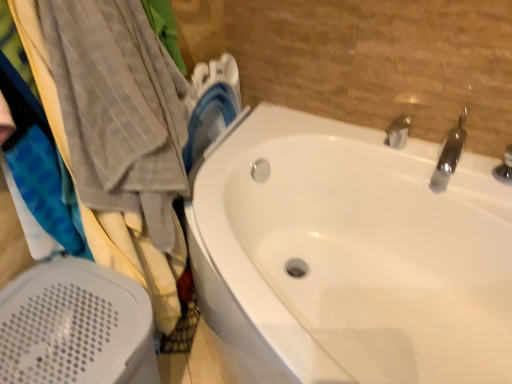
Where is `white glossy bathtub at center`? Image resolution: width=512 pixels, height=384 pixels. white glossy bathtub at center is located at coordinates (350, 256).

In order to click on white glossy bathtub at center in this screenshot , I will do `click(350, 256)`.

From the image's perspective, which one is positioned lower, polished chrome faucet at upper right, the first tap when ordered from right to left, or white plastic bath heater at lower left?

white plastic bath heater at lower left appears lower in the image.

Which is farther from the camera, [455,146] or [30,322]?

The point [455,146] is farther.

Is polished chrome faucet at upper right, the first tap when ordered from right to left, positioned with its back to white plastic bath heater at lower left?

No, polished chrome faucet at upper right, the first tap when ordered from right to left,'s orientation is not away from white plastic bath heater at lower left.

Can you confirm if polished chrome faucet at upper right, the first tap when ordered from right to left, is wider than white plastic bath heater at lower left?

Incorrect, the width of polished chrome faucet at upper right, the first tap when ordered from right to left, does not surpass that of white plastic bath heater at lower left.

Which is less distant, [60,381] or [428,353]?

The point [60,381] is in front.

Which object is positioned more to the left, white plastic bath heater at lower left or white glossy bathtub at center?

From the viewer's perspective, white plastic bath heater at lower left appears more on the left side.

Is white plastic bath heater at lower left oriented away from white glossy bathtub at center?

Yes.

Considering the relative sizes of white plastic bath heater at lower left and silver metallic tap at upper right, the 2th tap in the right-to-left sequence, in the image provided, is white plastic bath heater at lower left shorter than silver metallic tap at upper right, the 2th tap in the right-to-left sequence,?

In fact, white plastic bath heater at lower left may be taller than silver metallic tap at upper right, the 2th tap in the right-to-left sequence.

Is white plastic bath heater at lower left aimed at silver metallic tap at upper right, the 2th tap in the right-to-left sequence?

No, white plastic bath heater at lower left is not turned towards silver metallic tap at upper right, the 2th tap in the right-to-left sequence.

Who is smaller, white plastic bath heater at lower left or silver metallic tap at upper right, the 2th tap in the right-to-left sequence?

With smaller size is silver metallic tap at upper right, the 2th tap in the right-to-left sequence.

Does point (94, 279) come farther from viewer compared to point (396, 136)?

No, (94, 279) is closer to viewer.

Is polished chrome faucet at upper right, the first tap when ordered from right to left, at the back of white plastic bath heater at lower left?

No, white plastic bath heater at lower left is not facing the opposite direction of polished chrome faucet at upper right, the first tap when ordered from right to left.

Locate an element on the screen. bath heater below the polished chrome faucet at upper right, acting as the 2th tap starting from the left (from the image's perspective) is located at coordinates (75, 326).

From the image's perspective, which object appears higher, white plastic bath heater at lower left or polished chrome faucet at upper right, acting as the 2th tap starting from the left?

polished chrome faucet at upper right, acting as the 2th tap starting from the left.

From a real-world perspective, between white plastic bath heater at lower left and polished chrome faucet at upper right, acting as the 2th tap starting from the left, who is vertically lower?

white plastic bath heater at lower left, from a real-world perspective.

Is white plastic bath heater at lower left at the back of white glossy bathtub at center?

white glossy bathtub at center does not have its back to white plastic bath heater at lower left.

Based on the photo, is white glossy bathtub at center to the left of white plastic bath heater at lower left from the viewer's perspective?

In fact, white glossy bathtub at center is to the right of white plastic bath heater at lower left.

Is white glossy bathtub at center inside or outside of white plastic bath heater at lower left?

white glossy bathtub at center is not inside white plastic bath heater at lower left, it's outside.

Is silver metallic tap at upper right, which ranks as the first tap in left-to-right order, shorter than polished chrome faucet at upper right, acting as the 2th tap starting from the left?

Yes.

Is silver metallic tap at upper right, the 2th tap in the right-to-left sequence, touching polished chrome faucet at upper right, acting as the 2th tap starting from the left?

No.

Which is in front, silver metallic tap at upper right, the 2th tap in the right-to-left sequence, or polished chrome faucet at upper right, acting as the 2th tap starting from the left?

polished chrome faucet at upper right, acting as the 2th tap starting from the left, is in front.

How distant is silver metallic tap at upper right, the 2th tap in the right-to-left sequence, from polished chrome faucet at upper right, the first tap when ordered from right to left?

A distance of 5.55 inches exists between silver metallic tap at upper right, the 2th tap in the right-to-left sequence, and polished chrome faucet at upper right, the first tap when ordered from right to left.

Which is in front, polished chrome faucet at upper right, the first tap when ordered from right to left, or white glossy bathtub at center?

Positioned in front is white glossy bathtub at center.

Is polished chrome faucet at upper right, acting as the 2th tap starting from the left, far away from white glossy bathtub at center?

No, polished chrome faucet at upper right, acting as the 2th tap starting from the left, is not far from white glossy bathtub at center.

Can you confirm if polished chrome faucet at upper right, the first tap when ordered from right to left, is shorter than white glossy bathtub at center?

Correct, polished chrome faucet at upper right, the first tap when ordered from right to left, is not as tall as white glossy bathtub at center.

Image resolution: width=512 pixels, height=384 pixels. Find the location of `the 2nd tap to the right of the white plastic bath heater at lower left, counting from the anchor's position`. the 2nd tap to the right of the white plastic bath heater at lower left, counting from the anchor's position is located at coordinates (449, 154).

Locate an element on the screen. The image size is (512, 384). bathtub below the white plastic bath heater at lower left (from a real-world perspective) is located at coordinates (350, 256).

Based on their spatial positions, is white glossy bathtub at center or polished chrome faucet at upper right, acting as the 2th tap starting from the left, closer to white plastic bath heater at lower left?

white glossy bathtub at center is closer to white plastic bath heater at lower left.

When comparing their distances from white plastic bath heater at lower left, does silver metallic tap at upper right, which ranks as the first tap in left-to-right order, or white glossy bathtub at center seem further?

The object further to white plastic bath heater at lower left is silver metallic tap at upper right, which ranks as the first tap in left-to-right order.

From the image, which object appears to be farther from white plastic bath heater at lower left, silver metallic tap at upper right, the 2th tap in the right-to-left sequence, or polished chrome faucet at upper right, acting as the 2th tap starting from the left?

polished chrome faucet at upper right, acting as the 2th tap starting from the left, lies further to white plastic bath heater at lower left than the other object.

Estimate the real-world distances between objects in this image. Which object is closer to white plastic bath heater at lower left, polished chrome faucet at upper right, acting as the 2th tap starting from the left, or silver metallic tap at upper right, which ranks as the first tap in left-to-right order?

Among the two, silver metallic tap at upper right, which ranks as the first tap in left-to-right order, is located nearer to white plastic bath heater at lower left.

From the image, which object appears to be farther from silver metallic tap at upper right, which ranks as the first tap in left-to-right order, polished chrome faucet at upper right, the first tap when ordered from right to left, or white glossy bathtub at center?

white glossy bathtub at center is further to silver metallic tap at upper right, which ranks as the first tap in left-to-right order.

Looking at the image, which one is located closer to polished chrome faucet at upper right, acting as the 2th tap starting from the left, white glossy bathtub at center or silver metallic tap at upper right, which ranks as the first tap in left-to-right order?

The object closer to polished chrome faucet at upper right, acting as the 2th tap starting from the left, is silver metallic tap at upper right, which ranks as the first tap in left-to-right order.

Looking at this image, which object lies nearer to the anchor point polished chrome faucet at upper right, the first tap when ordered from right to left, white plastic bath heater at lower left or silver metallic tap at upper right, the 2th tap in the right-to-left sequence?

Based on the image, silver metallic tap at upper right, the 2th tap in the right-to-left sequence, appears to be nearer to polished chrome faucet at upper right, the first tap when ordered from right to left.

Looking at this image, considering their positions, is silver metallic tap at upper right, the 2th tap in the right-to-left sequence, positioned further to polished chrome faucet at upper right, the first tap when ordered from right to left, than white glossy bathtub at center?

white glossy bathtub at center is positioned further to the anchor polished chrome faucet at upper right, the first tap when ordered from right to left.

Locate an element on the screen. tap between white glossy bathtub at center and silver metallic tap at upper right, the 2th tap in the right-to-left sequence, in the front-back direction is located at coordinates (449, 154).

Find the location of a particular element. bathtub situated between white plastic bath heater at lower left and silver metallic tap at upper right, which ranks as the first tap in left-to-right order, from left to right is located at coordinates (350, 256).

You are a GUI agent. You are given a task and a screenshot of the screen. Output one action in this format:
    pyautogui.click(x=<x>, y=<y>)
    Task: Click on the tap between white plastic bath heater at lower left and polished chrome faucet at upper right, acting as the 2th tap starting from the left, from left to right
    This screenshot has width=512, height=384.
    Given the screenshot: What is the action you would take?
    pyautogui.click(x=398, y=131)

Identify the location of bathtub located between white plastic bath heater at lower left and polished chrome faucet at upper right, acting as the 2th tap starting from the left, in the left-right direction. The height and width of the screenshot is (384, 512). (350, 256).